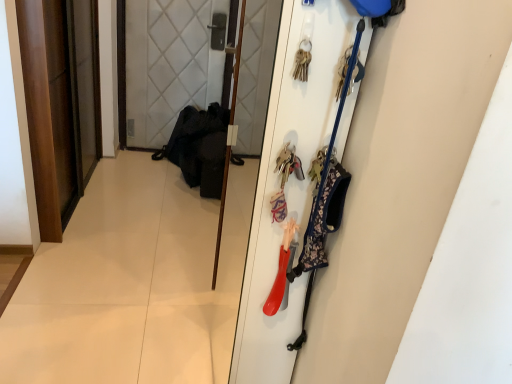
The height and width of the screenshot is (384, 512). In order to click on vacant area on the back side of wooden screen door at center in this screenshot , I will do `click(203, 203)`.